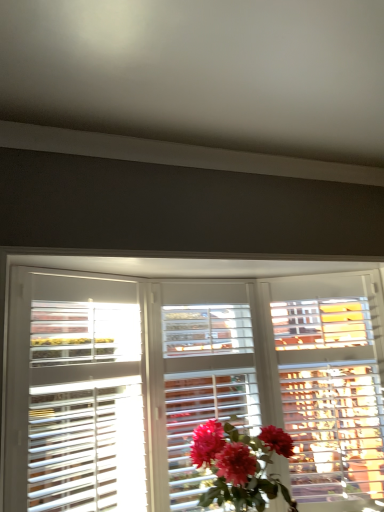
The width and height of the screenshot is (384, 512). Find the location of `matte pink petals at center`. matte pink petals at center is located at coordinates (237, 450).

What do you see at coordinates (237, 450) in the screenshot?
I see `matte pink petals at center` at bounding box center [237, 450].

In order to face matte pink petals at center, should I rotate leftwards or rightwards?

To align with it, rotate right about 8.133°.

You are a GUI agent. You are given a task and a screenshot of the screen. Output one action in this format:
    pyautogui.click(x=<x>, y=<y>)
    Task: Click on the white wooden blinds at center
    
    Given the screenshot: What is the action you would take?
    pyautogui.click(x=188, y=381)

This screenshot has height=512, width=384. Describe the element at coordinates (188, 381) in the screenshot. I see `white wooden blinds at center` at that location.

You are a GUI agent. You are given a task and a screenshot of the screen. Output one action in this format:
    pyautogui.click(x=<x>, y=<y>)
    Task: Click on the matte pink petals at center
    
    Given the screenshot: What is the action you would take?
    pyautogui.click(x=237, y=450)

Does matte pink petals at center appear on the right side of white wooden blinds at center?

Yes, matte pink petals at center is to the right of white wooden blinds at center.

In the image, is matte pink petals at center positioned in front of or behind white wooden blinds at center?

matte pink petals at center is behind white wooden blinds at center.

Is point (265, 458) positioned after point (141, 478)?

That is False.

Looking at this image, from the image's perspective, is matte pink petals at center positioned above or below white wooden blinds at center?

Clearly, from the image's perspective, matte pink petals at center is below white wooden blinds at center.

In the scene shown: From a real-world perspective, between matte pink petals at center and white wooden blinds at center, who is vertically higher?

From a 3D spatial view, white wooden blinds at center is above.

Is matte pink petals at center wider than white wooden blinds at center?

In fact, matte pink petals at center might be narrower than white wooden blinds at center.

Is matte pink petals at center taller or shorter than white wooden blinds at center?

matte pink petals at center is shorter than white wooden blinds at center.

Looking at this image, is matte pink petals at center bigger than white wooden blinds at center?

No, matte pink petals at center is not bigger than white wooden blinds at center.

Is white wooden blinds at center surrounded by matte pink petals at center?

No, white wooden blinds at center is located outside of matte pink petals at center.

Is matte pink petals at center directly adjacent to white wooden blinds at center?

No, matte pink petals at center is not touching white wooden blinds at center.

Could you tell me if matte pink petals at center is facing white wooden blinds at center?

No.

Consider the image. Measure the distance from matte pink petals at center to white wooden blinds at center.

A distance of 17.70 inches exists between matte pink petals at center and white wooden blinds at center.

Image resolution: width=384 pixels, height=512 pixels. In order to click on window in front of the matte pink petals at center in this screenshot , I will do `click(188, 381)`.

Which object is positioned more to the left, white wooden blinds at center or matte pink petals at center?

From the viewer's perspective, white wooden blinds at center appears more on the left side.

Which object is closer to the camera taking this photo, white wooden blinds at center or matte pink petals at center?

white wooden blinds at center.

Which is behind, point (5, 479) or point (214, 429)?

The point (214, 429) is behind.

Based on the photo, from the image's perspective, between white wooden blinds at center and matte pink petals at center, which one is located above?

white wooden blinds at center, from the image's perspective.

From a real-world perspective, is white wooden blinds at center above or below matte pink petals at center?

Clearly, from a real-world perspective, white wooden blinds at center is above matte pink petals at center.

Which object is wider, white wooden blinds at center or matte pink petals at center?

With larger width is white wooden blinds at center.

Can you confirm if white wooden blinds at center is shorter than matte pink petals at center?

No.

Which of these two, white wooden blinds at center or matte pink petals at center, is bigger?

white wooden blinds at center.

Choose the correct answer: Is white wooden blinds at center inside matte pink petals at center or outside it?

white wooden blinds at center cannot be found inside matte pink petals at center.

Is white wooden blinds at center next to matte pink petals at center?

No, white wooden blinds at center is not with matte pink petals at center.

Is matte pink petals at center at the back of white wooden blinds at center?

Yes, matte pink petals at center is at the back of white wooden blinds at center.

Can you tell me how much white wooden blinds at center and matte pink petals at center differ in facing direction?

The facing directions of white wooden blinds at center and matte pink petals at center are 0.221 degrees apart.

Where is `window on the left of matte pink petals at center`? The image size is (384, 512). window on the left of matte pink petals at center is located at coordinates (188, 381).

You are a GUI agent. You are given a task and a screenshot of the screen. Output one action in this format:
    pyautogui.click(x=<x>, y=<y>)
    Task: Click on the flower that appears below the white wooden blinds at center (from a real-world perspective)
    
    Given the screenshot: What is the action you would take?
    pyautogui.click(x=237, y=450)

Where is `flower located below the white wooden blinds at center (from the image's perspective)`? The image size is (384, 512). flower located below the white wooden blinds at center (from the image's perspective) is located at coordinates (237, 450).